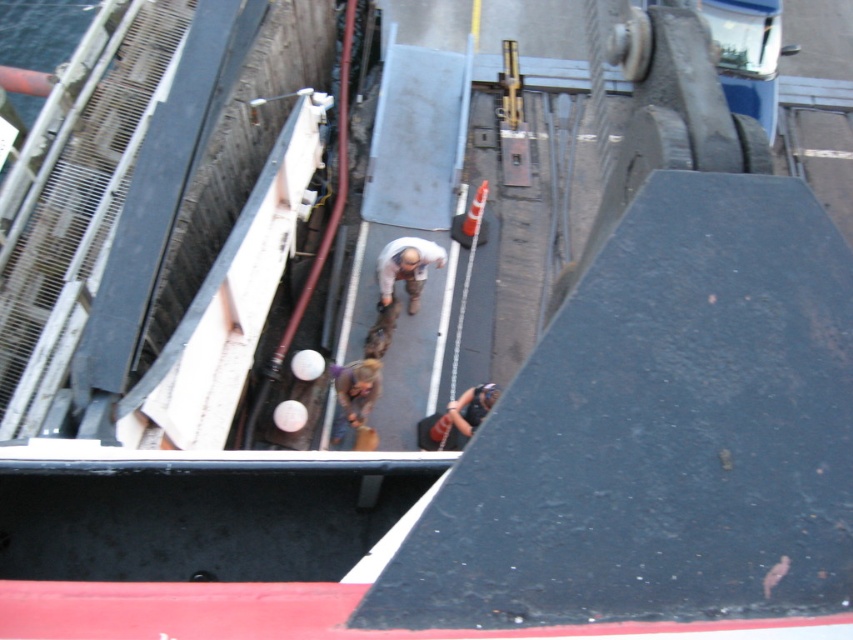
Between light brown fabric pants at center and matte black helmet at upper center, which one is positioned higher?

light brown fabric pants at center is higher up.

Does light brown fabric pants at center appear over matte black helmet at upper center?

Indeed, light brown fabric pants at center is positioned over matte black helmet at upper center.

Does point (430, 250) come closer to viewer compared to point (469, 406)?

No.

This screenshot has height=640, width=853. Identify the location of light brown fabric pants at center. (405, 268).

Who is positioned more to the left, light brown fabric pants at center or brown leather jacket at center?

brown leather jacket at center

Which is behind, point (409, 300) or point (352, 401)?

The point (409, 300) is more distant.

Where is `light brown fabric pants at center`? The height and width of the screenshot is (640, 853). light brown fabric pants at center is located at coordinates (405, 268).

Which is more to the right, brown leather jacket at center or matte black helmet at upper center?

Positioned to the right is matte black helmet at upper center.

The height and width of the screenshot is (640, 853). What do you see at coordinates (352, 394) in the screenshot? I see `brown leather jacket at center` at bounding box center [352, 394].

Where is `brown leather jacket at center`? The image size is (853, 640). brown leather jacket at center is located at coordinates (352, 394).